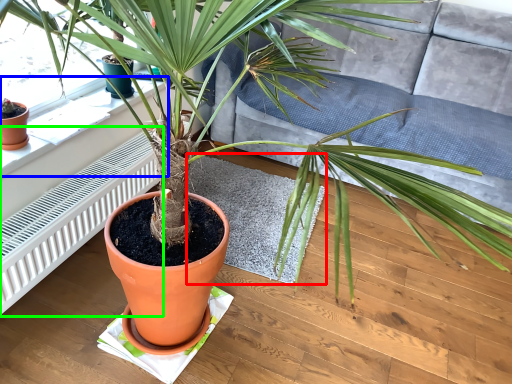
Question: Which object is the farthest from mat (highlighted by a red box)? Choose among these: window sill (highlighted by a blue box) or radiator (highlighted by a green box).

Choices:
 (A) window sill
 (B) radiator

Answer: (A)